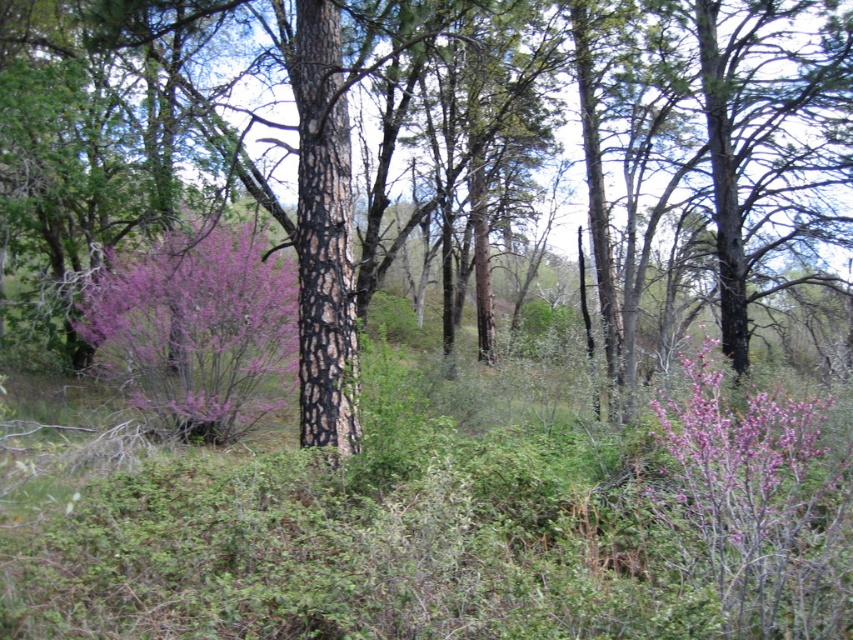
You are standing in the forest and want to locate the brown rough bark tree at center. What are its coordinates in the image?

The brown rough bark tree at center is located at coordinates point (x=430, y=152).

You are an artist planning to paint the forest scene. You want to ensure the brown rough bark tree at center and the purple bloom at right are proportionally accurate. Which object should you draw wider in your painting?

The brown rough bark tree at center should be drawn wider than the purple bloom at right because its width is larger according to the description.

You are an artist setting up an easel to paint the purple matte bush at left and the purple bloom at right. Which object requires a larger canvas area to capture its full width?

The purple matte bush at left requires a larger canvas area because its width surpasses that of the purple bloom at right.